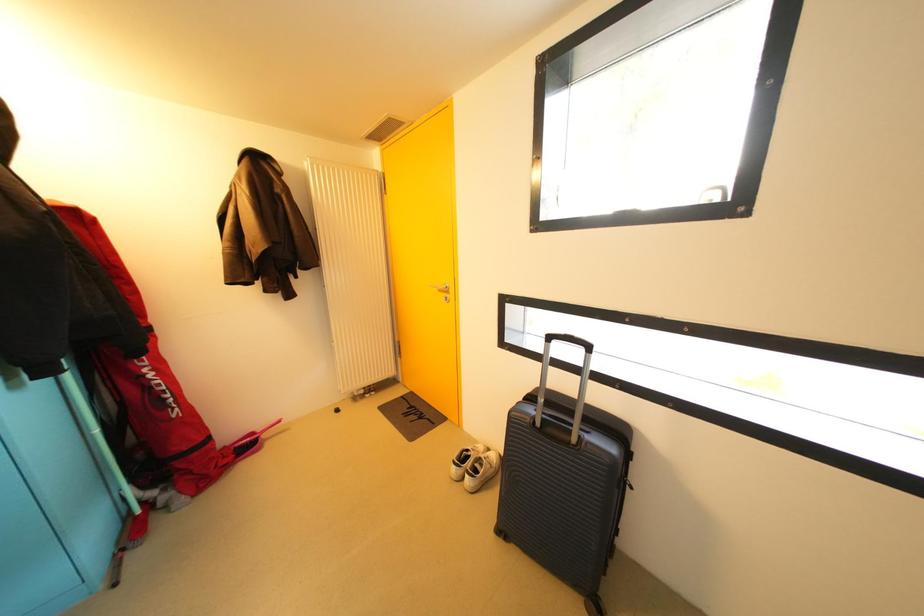
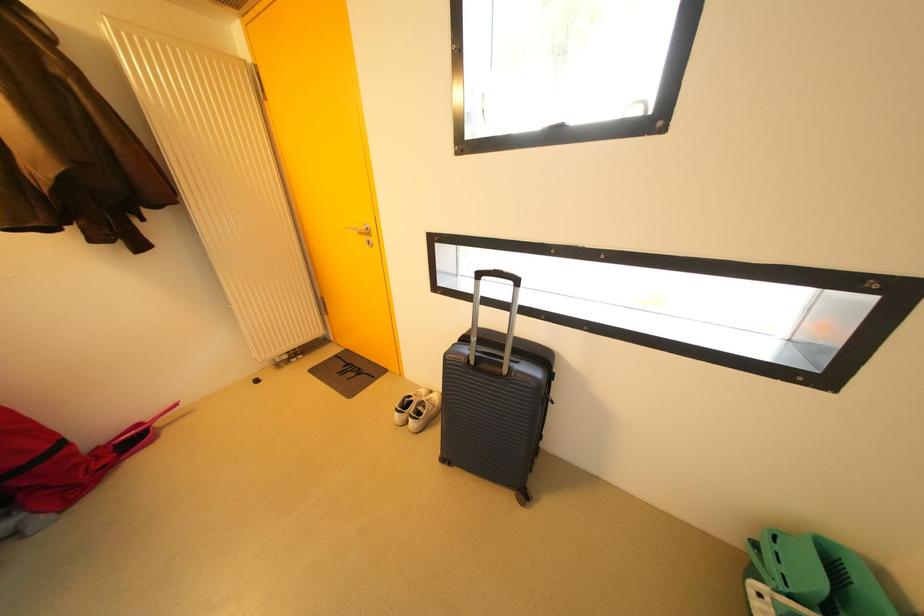
The images are taken continuously from a first-person perspective. In which direction are you moving?

The cameraman moved toward right, forward.